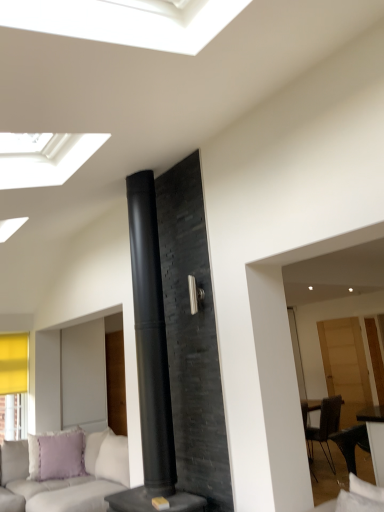
Question: Is black matte fireplace at center facing away from translucent wood door at right?

Choices:
 (A) no
 (B) yes

Answer: (A)

Question: From the image's perspective, is black matte fireplace at center over translucent wood door at right?

Choices:
 (A) yes
 (B) no

Answer: (A)

Question: Considering the relative sizes of black matte fireplace at center and translucent wood door at right in the image provided, is black matte fireplace at center smaller than translucent wood door at right?

Choices:
 (A) yes
 (B) no

Answer: (B)

Question: Does black matte fireplace at center have a lesser height compared to translucent wood door at right?

Choices:
 (A) yes
 (B) no

Answer: (B)

Question: Is black matte fireplace at center in contact with translucent wood door at right?

Choices:
 (A) no
 (B) yes

Answer: (A)

Question: From a real-world perspective, is black matte fireplace at center physically above translucent wood door at right?

Choices:
 (A) no
 (B) yes

Answer: (B)

Question: Considering the relative positions of translucent wood door at right and black matte fireplace at center in the image provided, is translucent wood door at right to the left of black matte fireplace at center from the viewer's perspective?

Choices:
 (A) no
 (B) yes

Answer: (A)

Question: From the image's perspective, is translucent wood door at right above black matte fireplace at center?

Choices:
 (A) no
 (B) yes

Answer: (A)

Question: Does translucent wood door at right appear on the right side of black matte fireplace at center?

Choices:
 (A) no
 (B) yes

Answer: (B)

Question: Can you confirm if translucent wood door at right is taller than black matte fireplace at center?

Choices:
 (A) yes
 (B) no

Answer: (B)

Question: Is translucent wood door at right positioned in front of black matte fireplace at center?

Choices:
 (A) no
 (B) yes

Answer: (A)

Question: Is translucent wood door at right looking in the opposite direction of black matte fireplace at center?

Choices:
 (A) yes
 (B) no

Answer: (B)

Question: Would you say translucent wood door at right contains lavender fabric pillow at lower left?

Choices:
 (A) no
 (B) yes

Answer: (A)